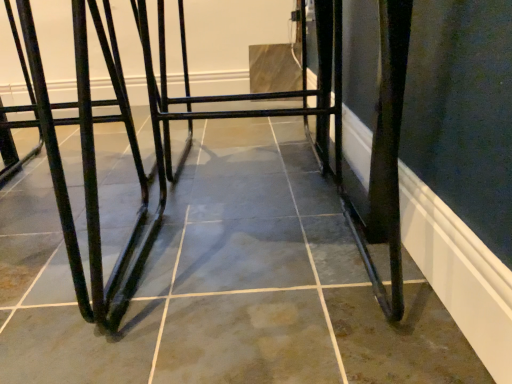
The height and width of the screenshot is (384, 512). What do you see at coordinates (191, 135) in the screenshot?
I see `black metal table at center` at bounding box center [191, 135].

Identify the location of black metal table at center. This screenshot has height=384, width=512. (191, 135).

The image size is (512, 384). What do you see at coordinates (86, 160) in the screenshot? I see `matte black metal bar stool at left` at bounding box center [86, 160].

Identify the location of matte black metal bar stool at left. The image size is (512, 384). (86, 160).

Image resolution: width=512 pixels, height=384 pixels. I want to click on black metal table at center, so click(191, 135).

Considering the relative positions of matte black metal bar stool at left and black metal table at center in the image provided, is matte black metal bar stool at left to the left of black metal table at center from the viewer's perspective?

Correct, you'll find matte black metal bar stool at left to the left of black metal table at center.

Considering their positions, is matte black metal bar stool at left located in front of or behind black metal table at center?

Clearly, matte black metal bar stool at left is behind black metal table at center.

Which is further, (52, 124) or (387, 61)?

The point (52, 124) is farther from the camera.

From the image's perspective, is matte black metal bar stool at left below black metal table at center?

Yes.

From a real-world perspective, is matte black metal bar stool at left physically above black metal table at center?

No, from a real-world perspective, matte black metal bar stool at left is not above black metal table at center.

Can you confirm if matte black metal bar stool at left is wider than black metal table at center?

Correct, the width of matte black metal bar stool at left exceeds that of black metal table at center.

Considering the sizes of objects matte black metal bar stool at left and black metal table at center in the image provided, who is shorter, matte black metal bar stool at left or black metal table at center?

black metal table at center.

Between matte black metal bar stool at left and black metal table at center, which one has larger size?

black metal table at center is bigger.

Would you say black metal table at center is part of matte black metal bar stool at left's contents?

That's incorrect, black metal table at center is not inside matte black metal bar stool at left.

Is matte black metal bar stool at left far from black metal table at center?

matte black metal bar stool at left is actually quite close to black metal table at center.

Is matte black metal bar stool at left looking in the opposite direction of black metal table at center?

matte black metal bar stool at left is not turned away from black metal table at center.

Measure the distance from matte black metal bar stool at left to black metal table at center.

A distance of 21.06 centimeters exists between matte black metal bar stool at left and black metal table at center.

This screenshot has height=384, width=512. In order to click on furniture above the matte black metal bar stool at left (from the image's perspective) in this screenshot , I will do `click(191, 135)`.

Based on the photo, which object is positioned more to the left, black metal table at center or matte black metal bar stool at left?

From the viewer's perspective, matte black metal bar stool at left appears more on the left side.

Is black metal table at center further to camera compared to matte black metal bar stool at left?

No, it is not.

Is point (77, 8) behind point (67, 242)?

No, (77, 8) is closer to viewer.

From the image's perspective, between black metal table at center and matte black metal bar stool at left, which one is located above?

black metal table at center is shown above in the image.

From a real-world perspective, between black metal table at center and matte black metal bar stool at left, who is vertically higher?

black metal table at center.

In the scene shown: Is black metal table at center wider or thinner than matte black metal bar stool at left?

Clearly, black metal table at center has less width compared to matte black metal bar stool at left.

Which of these two, black metal table at center or matte black metal bar stool at left, stands taller?

With more height is matte black metal bar stool at left.

Between black metal table at center and matte black metal bar stool at left, which one has smaller size?

Smaller between the two is matte black metal bar stool at left.

Is black metal table at center not within matte black metal bar stool at left?

Indeed, black metal table at center is completely outside matte black metal bar stool at left.

Looking at this image, is black metal table at center far away from matte black metal bar stool at left?

black metal table at center is near matte black metal bar stool at left, not far away.

Is black metal table at center oriented towards matte black metal bar stool at left?

No, black metal table at center does not turn towards matte black metal bar stool at left.

How much distance is there between black metal table at center and matte black metal bar stool at left?

black metal table at center and matte black metal bar stool at left are 8.29 inches apart.

In the image, there is a matte black metal bar stool at left. Where is `furniture above it (from the image's perspective)`? This screenshot has height=384, width=512. furniture above it (from the image's perspective) is located at coordinates (191, 135).

In the image, there is a matte black metal bar stool at left. Where is `furniture above it (from the image's perspective)`? Image resolution: width=512 pixels, height=384 pixels. furniture above it (from the image's perspective) is located at coordinates (191, 135).

Locate an element on the screen. Image resolution: width=512 pixels, height=384 pixels. furniture that is in front of the matte black metal bar stool at left is located at coordinates (191, 135).